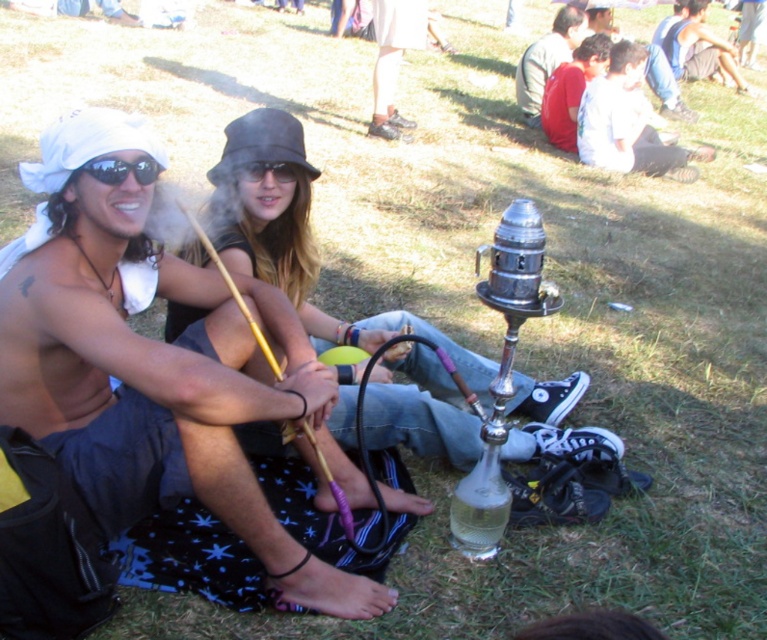
Question: Considering the real-world distances, which object is farthest from the red cotton shirt at upper right?

Choices:
 (A) black plastic sunglasses at upper left
 (B) denim jacket at upper right
 (C) dark gray fabric jacket at upper right

Answer: (A)

Question: Which point is farther to the camera?

Choices:
 (A) pos(642,45)
 (B) pos(542,72)
 (C) pos(120,212)
 (D) pos(723,44)

Answer: (D)

Question: Based on their relative distances, which object is nearer to the matte black shorts at left?

Choices:
 (A) dark gray fabric jacket at upper right
 (B) blue denim shorts at lower right

Answer: (A)

Question: Is matte black hookah at center wider than red cotton shirt at upper right?

Choices:
 (A) yes
 (B) no

Answer: (A)

Question: Is blue denim shorts at lower right above denim jacket at upper right?

Choices:
 (A) yes
 (B) no

Answer: (A)

Question: Can you confirm if red cotton shirt at upper right is thinner than blue denim shorts at lower right?

Choices:
 (A) no
 (B) yes

Answer: (B)